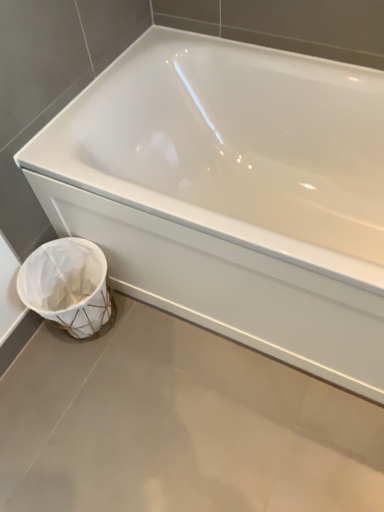
Find the location of a particular element. vacant space underneath white woven basket at lower left (from a real-world perspective) is located at coordinates (92, 333).